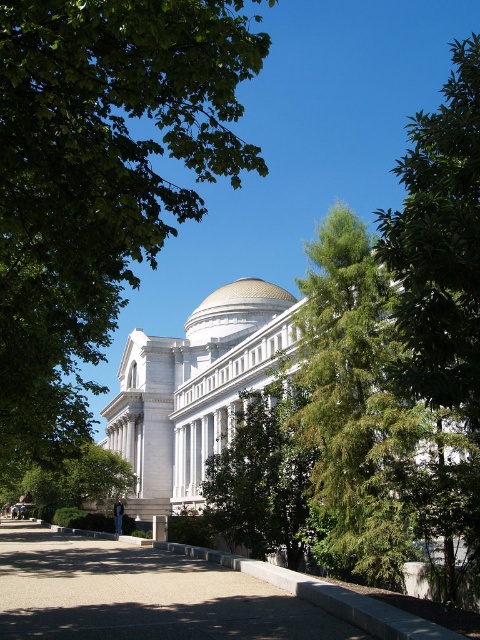
Question: Which point is closer to the camera taking this photo?

Choices:
 (A) (290, 417)
 (B) (163, 35)

Answer: (B)

Question: Which of the following is the farthest from the observer?

Choices:
 (A) (382, 340)
 (B) (239, 326)

Answer: (B)

Question: Does green leafy tree at upper left appear over gold metallic dome at center?

Choices:
 (A) yes
 (B) no

Answer: (A)

Question: Does green leafy tree at upper right have a larger size compared to gold metallic dome at center?

Choices:
 (A) yes
 (B) no

Answer: (A)

Question: Which point is farther to the camera?

Choices:
 (A) tap(146, 16)
 (B) tap(468, 45)
 (C) tap(368, 490)
 (D) tap(252, 305)

Answer: (B)

Question: Is the position of green leafy tree at upper right more distant than that of gold metallic dome at center?

Choices:
 (A) no
 (B) yes

Answer: (A)